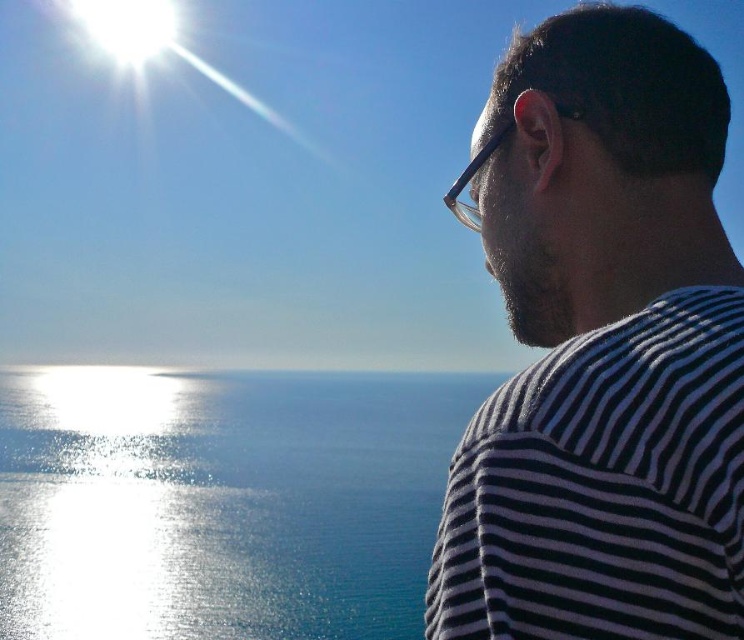
You are standing at the point marked by coordinates point (600, 348) in the image. Looking around, you see the black striped shirt at right. Which direction should you face to look towards the sun in the upper left corner?

The sun is in the upper left corner, so facing towards the upper left would direct your gaze toward it.

You are a photographer trying to capture the scene. The black striped shirt at right and the glistening blue water at center are both in your frame. Which object appears taller in the photo?

The glistening blue water at center appears taller than the black striped shirt at right in the photo.

You are a photographer trying to capture the reflection of the sun on the glistening blue water at center. However, there is a black striped shirt at right in the way. From the perspective of the photographer, which object is closer to the right edge of the frame?

The black striped shirt at right is positioned on the right side of glistening blue water at center, so it is closer to the right edge of the frame.